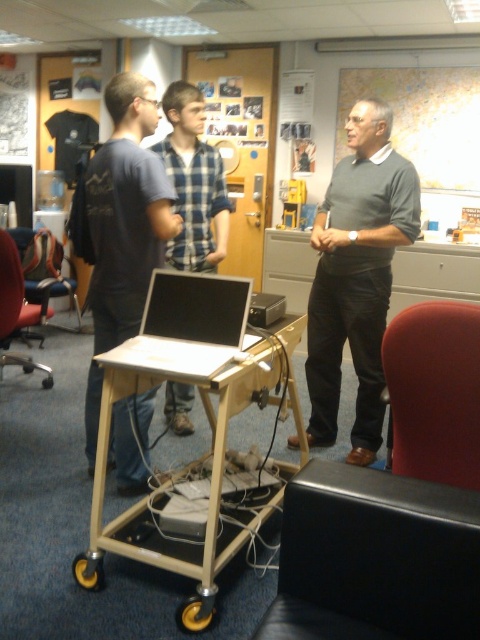
You are a person standing in the office and want to reach the silver metallic laptop at center without moving the blue plaid shirt at center. Is this possible?

The silver metallic laptop at center is positioned under the blue plaid shirt at center, so you can reach the laptop by moving your hand under the shirt without disturbing it.

You are a delivery person who needs to place a small package between the gray sweater at center and the silver metallic laptop at center. Can you fit it there?

The gray sweater at center and the silver metallic laptop at center are 99.73 centimeters apart, so yes, the package can fit between them as the distance is sufficient.

You are organizing a presentation and need to place the silver metallic laptop at center and the blue plaid shirt at center on a desk. Which object should you place first if you want to ensure there is enough space for both?

The silver metallic laptop at center should be placed first since it is smaller than the blue plaid shirt at center, allowing more space for the larger item afterward.